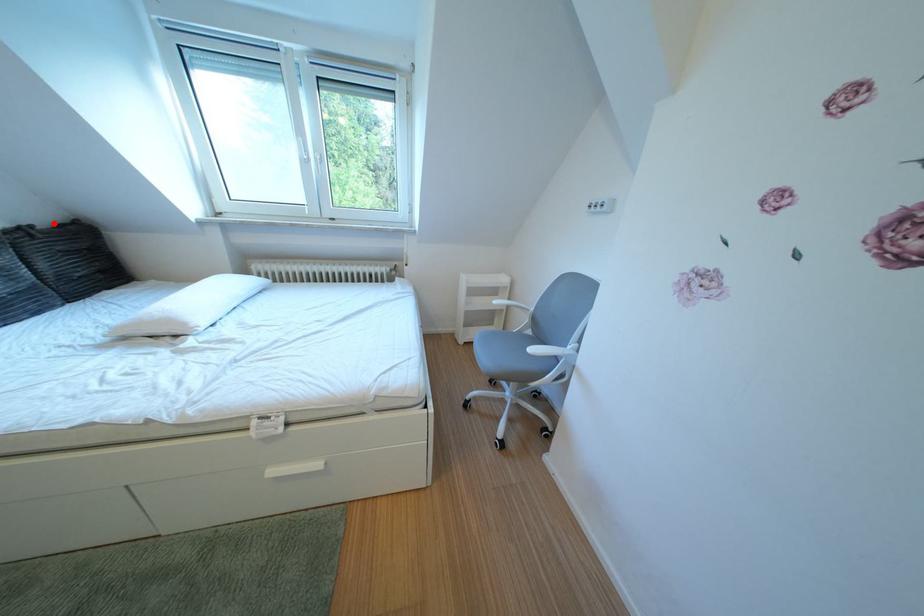
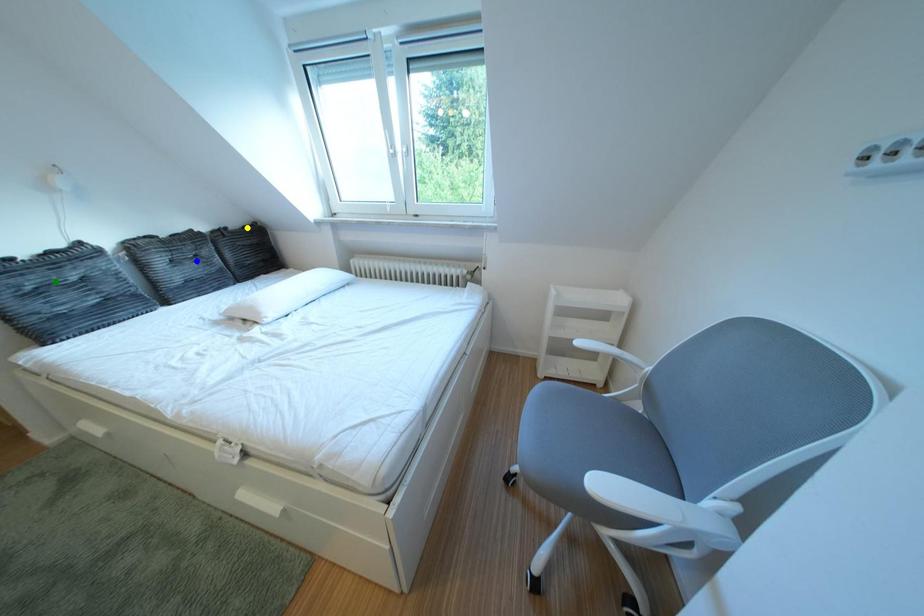
Question: I am providing you with two images of the same scene from different viewpoints. A red point is marked on the first image. You are given multiple points on the second image. Which point in image 2 is actually the same real-world point as the red point in image 1?

Choices:
 (A) blue point
 (B) green point
 (C) yellow point

Answer: (C)